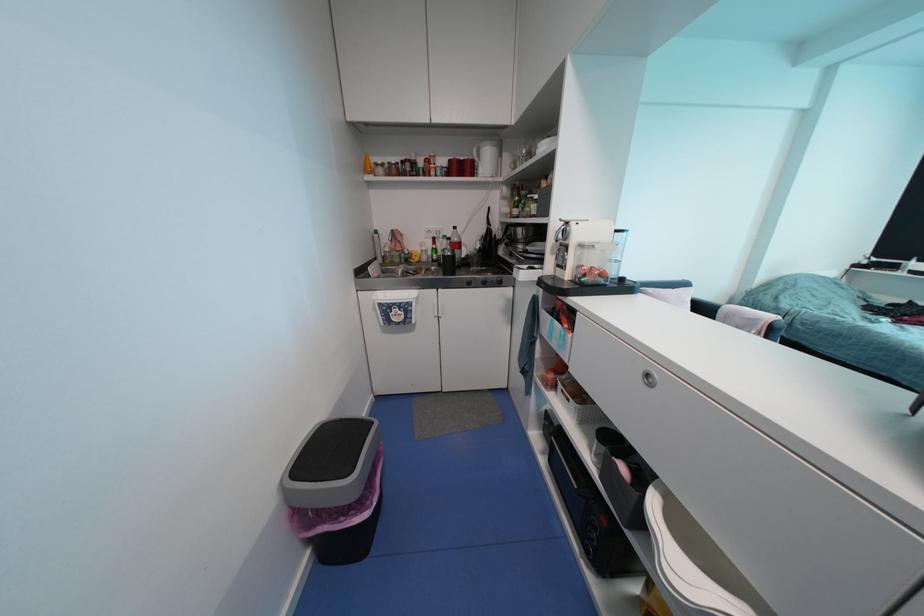
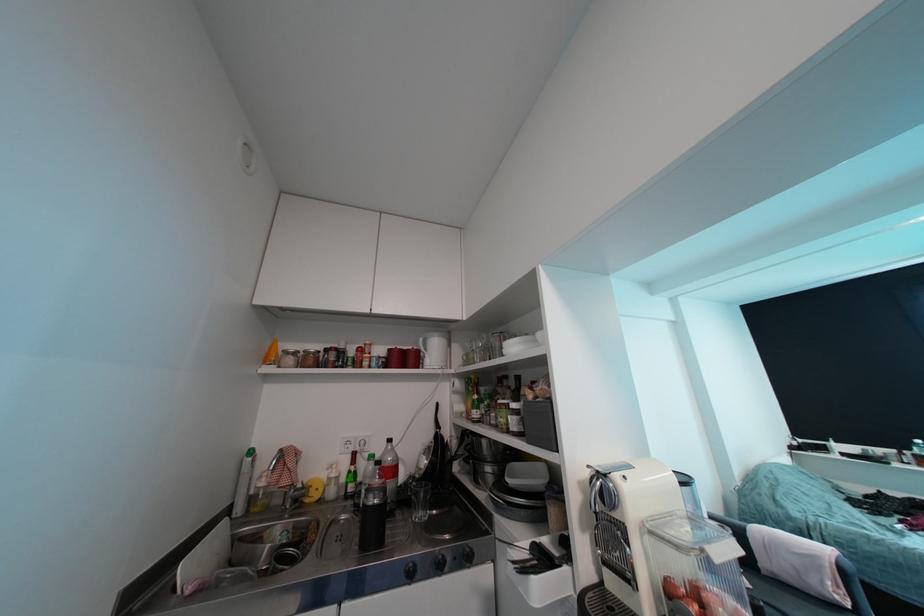
How did the camera likely rotate?

The camera's rotation is toward right-up.